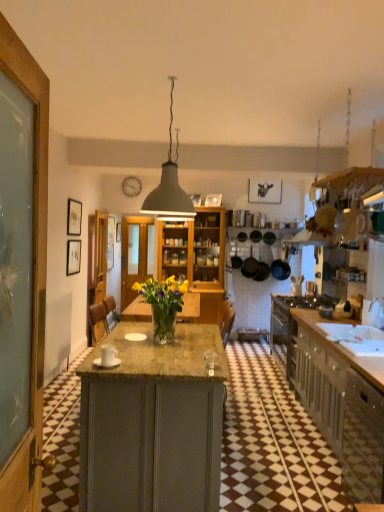
Question: Is translucent glass vase at center further to camera compared to black matte frying pans at center, which is the 2th kitchen appliance from right to left?

Choices:
 (A) no
 (B) yes

Answer: (A)

Question: From the image's perspective, is translucent glass vase at center over black matte frying pans at center, which is the 2th kitchen appliance from right to left?

Choices:
 (A) yes
 (B) no

Answer: (B)

Question: Is translucent glass vase at center wider than black matte frying pans at center, which is the 2th kitchen appliance from right to left?

Choices:
 (A) yes
 (B) no

Answer: (A)

Question: Is black matte frying pans at center, marked as the second kitchen appliance in a left-to-right arrangement, located within translucent glass vase at center?

Choices:
 (A) no
 (B) yes

Answer: (A)

Question: Is translucent glass vase at center positioned with its back to black matte frying pans at center, which is the 2th kitchen appliance from right to left?

Choices:
 (A) no
 (B) yes

Answer: (A)

Question: Is translucent glass vase at center in contact with black matte frying pans at center, which is the 2th kitchen appliance from right to left?

Choices:
 (A) yes
 (B) no

Answer: (B)

Question: From a real-world perspective, is matte gray lampshade at center over translucent glass vase at center?

Choices:
 (A) no
 (B) yes

Answer: (B)

Question: Can you confirm if matte gray lampshade at center is thinner than translucent glass vase at center?

Choices:
 (A) no
 (B) yes

Answer: (B)

Question: Is matte gray lampshade at center in front of translucent glass vase at center?

Choices:
 (A) no
 (B) yes

Answer: (B)

Question: Can you confirm if matte gray lampshade at center is bigger than translucent glass vase at center?

Choices:
 (A) no
 (B) yes

Answer: (B)

Question: Can you confirm if matte gray lampshade at center is taller than translucent glass vase at center?

Choices:
 (A) no
 (B) yes

Answer: (B)

Question: Can we say matte gray lampshade at center lies outside translucent glass vase at center?

Choices:
 (A) yes
 (B) no

Answer: (A)

Question: Is black matte frying pans at center, which is the 2th kitchen appliance from right to left, wider than matte gray lampshade at center?

Choices:
 (A) yes
 (B) no

Answer: (B)